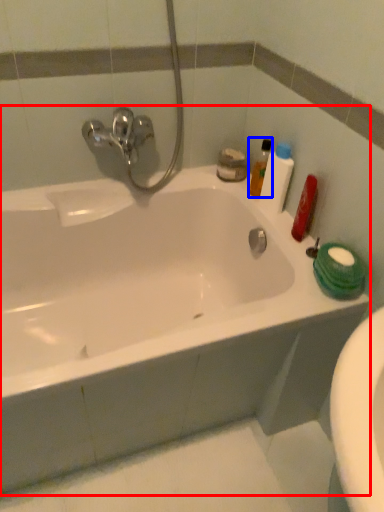
Question: Which object appears farthest to the camera in this image, bathtub (highlighted by a red box) or cleaning product (highlighted by a blue box)?

Choices:
 (A) bathtub
 (B) cleaning product

Answer: (B)